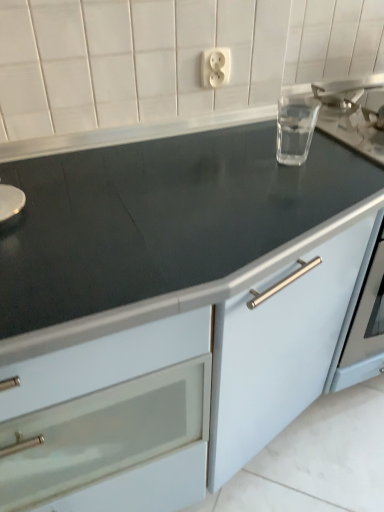
Question: From the image's perspective, is white plastic outlet at upper center on top of transparent glass at upper right?

Choices:
 (A) no
 (B) yes

Answer: (B)

Question: Can transparent glass at upper right be found inside white plastic outlet at upper center?

Choices:
 (A) yes
 (B) no

Answer: (B)

Question: Is white plastic outlet at upper center touching transparent glass at upper right?

Choices:
 (A) no
 (B) yes

Answer: (A)

Question: From the image's perspective, is white plastic outlet at upper center beneath transparent glass at upper right?

Choices:
 (A) yes
 (B) no

Answer: (B)

Question: Is white plastic outlet at upper center positioned in front of transparent glass at upper right?

Choices:
 (A) yes
 (B) no

Answer: (B)

Question: From the image's perspective, is white plastic outlet at upper center above or below matte white cabinet at center?

Choices:
 (A) below
 (B) above

Answer: (B)

Question: In terms of size, does white plastic outlet at upper center appear bigger or smaller than matte white cabinet at center?

Choices:
 (A) big
 (B) small

Answer: (B)

Question: Considering the positions of white plastic outlet at upper center and matte white cabinet at center in the image, is white plastic outlet at upper center taller or shorter than matte white cabinet at center?

Choices:
 (A) tall
 (B) short

Answer: (B)

Question: Does point (216, 78) appear closer or farther from the camera than point (16, 445)?

Choices:
 (A) farther
 (B) closer

Answer: (A)

Question: Considering the positions of transparent glass at upper right and matte white cabinet at center in the image, is transparent glass at upper right bigger or smaller than matte white cabinet at center?

Choices:
 (A) big
 (B) small

Answer: (B)

Question: Considering their positions, is transparent glass at upper right located in front of or behind matte white cabinet at center?

Choices:
 (A) behind
 (B) front

Answer: (A)

Question: From the image's perspective, relative to matte white cabinet at center, is transparent glass at upper right above or below?

Choices:
 (A) below
 (B) above

Answer: (B)

Question: From their relative heights in the image, would you say transparent glass at upper right is taller or shorter than matte white cabinet at center?

Choices:
 (A) short
 (B) tall

Answer: (A)

Question: Considering the positions of white plastic outlet at upper center and transparent glass at upper right in the image, is white plastic outlet at upper center taller or shorter than transparent glass at upper right?

Choices:
 (A) tall
 (B) short

Answer: (B)

Question: Is white plastic outlet at upper center inside the boundaries of transparent glass at upper right, or outside?

Choices:
 (A) inside
 (B) outside

Answer: (B)